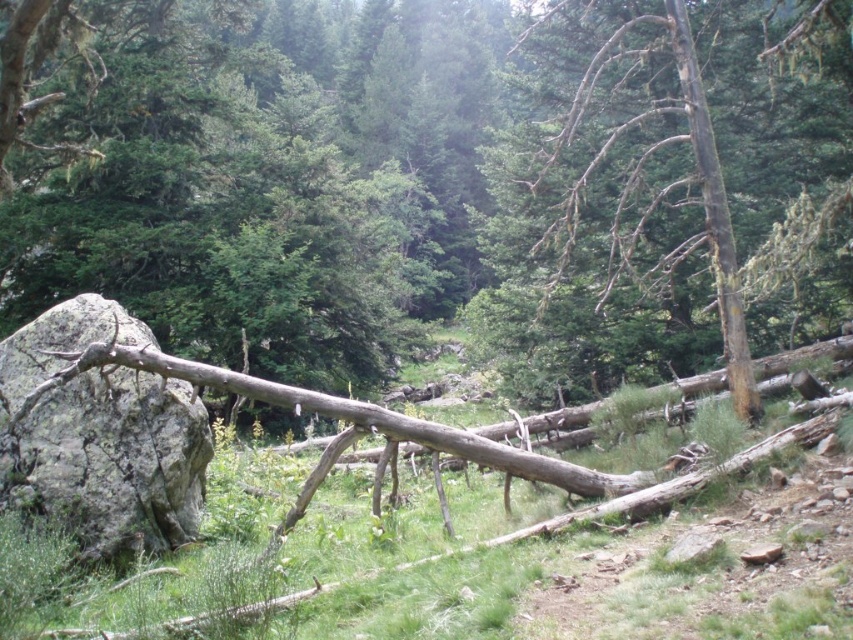
Describe the element at coordinates (100, 435) in the screenshot. The width and height of the screenshot is (853, 640). I see `gray rough boulder at left` at that location.

Where is `gray rough boulder at left`? The height and width of the screenshot is (640, 853). gray rough boulder at left is located at coordinates coord(100,435).

Is point (165, 529) positioned behind point (703, 93)?

That is False.

The height and width of the screenshot is (640, 853). In order to click on gray rough boulder at left in this screenshot , I will do `click(100, 435)`.

What do you see at coordinates (664, 182) in the screenshot? The height and width of the screenshot is (640, 853). I see `charcoal gray bark tree at right` at bounding box center [664, 182].

Image resolution: width=853 pixels, height=640 pixels. I want to click on charcoal gray bark tree at right, so click(664, 182).

Who is more forward, (776, 321) or (692, 65)?

Point (692, 65) is in front.

Is brown rough tree trunk at center thinner than charcoal gray bark tree at right?

Incorrect, brown rough tree trunk at center's width is not less than charcoal gray bark tree at right's.

Consider the image. Measure the distance between brown rough tree trunk at center and camera.

brown rough tree trunk at center is 6.40 meters away from camera.

At what (x,y) coordinates should I click in order to perform the action: click on brown rough tree trunk at center. Please return your answer as a coordinate pair (x, y). The height and width of the screenshot is (640, 853). Looking at the image, I should click on (434, 184).